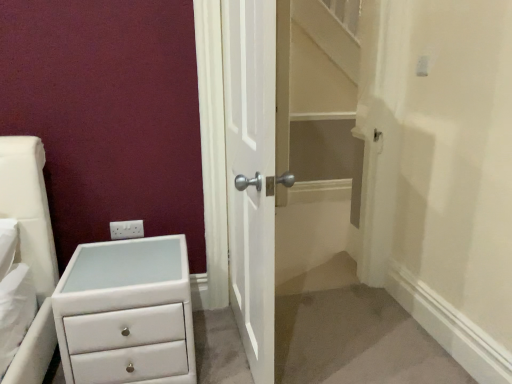
The image size is (512, 384). In order to click on white plastic electric outlet at upper left in this screenshot , I will do `click(126, 229)`.

Describe the element at coordinates (126, 313) in the screenshot. I see `white glossy chest of drawers at lower left` at that location.

The width and height of the screenshot is (512, 384). I want to click on white plastic electric outlet at upper left, so click(126, 229).

Is white plastic electric outlet at upper left turned away from white glossy chest of drawers at lower left?

No, white plastic electric outlet at upper left is not facing the opposite direction of white glossy chest of drawers at lower left.

You are a GUI agent. You are given a task and a screenshot of the screen. Output one action in this format:
    pyautogui.click(x=<x>, y=<y>)
    Task: Click on the electric outlet behind the white glossy chest of drawers at lower left
    This screenshot has width=512, height=384.
    Given the screenshot: What is the action you would take?
    pyautogui.click(x=126, y=229)

From a real-world perspective, between white plastic electric outlet at upper left and white glossy chest of drawers at lower left, who is vertically higher?

white plastic electric outlet at upper left.

In order to click on door that is above the white plastic electric outlet at upper left (from the image's perspective) in this screenshot , I will do `click(253, 169)`.

Is white plastic electric outlet at upper left next to white wooden door at center and touching it?

No, white plastic electric outlet at upper left is not in contact with white wooden door at center.

From a real-world perspective, is white plastic electric outlet at upper left positioned under white wooden door at center based on gravity?

Yes, from a real-world perspective, white plastic electric outlet at upper left is below white wooden door at center.

Who is shorter, white plastic electric outlet at upper left or white wooden door at center?

white plastic electric outlet at upper left is shorter.

Where is `door that appears above the white plastic electric outlet at upper left (from the image's perspective)`? This screenshot has height=384, width=512. door that appears above the white plastic electric outlet at upper left (from the image's perspective) is located at coordinates (253, 169).

From the image's perspective, is white wooden door at center over white plastic electric outlet at upper left?

Yes, from the image's perspective, white wooden door at center is on top of white plastic electric outlet at upper left.

Considering the positions of objects white wooden door at center and white plastic electric outlet at upper left in the image provided, who is more to the right, white wooden door at center or white plastic electric outlet at upper left?

white wooden door at center.

In the scene shown: Do you think white wooden door at center is within white plastic electric outlet at upper left, or outside of it?

white wooden door at center is not enclosed by white plastic electric outlet at upper left.

Is white glossy chest of drawers at lower left taller or shorter than white wooden door at center?

Clearly, white glossy chest of drawers at lower left is shorter compared to white wooden door at center.

From the picture: Considering the sizes of objects white glossy chest of drawers at lower left and white wooden door at center in the image provided, who is wider, white glossy chest of drawers at lower left or white wooden door at center?

Wider between the two is white glossy chest of drawers at lower left.

From a real-world perspective, which object stands above the other?

white wooden door at center, from a real-world perspective.

Is point (180, 244) positioned before point (254, 133)?

No.

Does point (70, 292) lie in front of point (132, 227)?

Yes, it is.

Who is bigger, white glossy chest of drawers at lower left or white plastic electric outlet at upper left?

With larger size is white glossy chest of drawers at lower left.

From a real-world perspective, is white glossy chest of drawers at lower left on white plastic electric outlet at upper left?

Incorrect, from a real-world perspective, white glossy chest of drawers at lower left is lower than white plastic electric outlet at upper left.

How many degrees apart are the facing directions of white glossy chest of drawers at lower left and white plastic electric outlet at upper left?

The facing directions of white glossy chest of drawers at lower left and white plastic electric outlet at upper left are 0.925 degrees apart.

How many degrees apart are the facing directions of white wooden door at center and white glossy chest of drawers at lower left?

The angle between the facing direction of white wooden door at center and the facing direction of white glossy chest of drawers at lower left is 89.7 degrees.

Is white wooden door at center bigger or smaller than white glossy chest of drawers at lower left?

Considering their sizes, white wooden door at center takes up more space than white glossy chest of drawers at lower left.

This screenshot has height=384, width=512. Find the location of `the chest of drawers located underneath the white wooden door at center (from a real-world perspective)`. the chest of drawers located underneath the white wooden door at center (from a real-world perspective) is located at coordinates (126, 313).

Relative to white glossy chest of drawers at lower left, is white wooden door at center in front or behind?

white wooden door at center is in front of white glossy chest of drawers at lower left.

The image size is (512, 384). I want to click on electric outlet on the left of white glossy chest of drawers at lower left, so click(x=126, y=229).

Find the location of a particular element. door located above the white plastic electric outlet at upper left (from the image's perspective) is located at coordinates (253, 169).

Considering their positions, is white wooden door at center positioned closer to white plastic electric outlet at upper left than white glossy chest of drawers at lower left?

Among the two, white glossy chest of drawers at lower left is located nearer to white plastic electric outlet at upper left.

From the picture: When comparing their distances from white glossy chest of drawers at lower left, does white plastic electric outlet at upper left or white wooden door at center seem closer?

white plastic electric outlet at upper left lies closer to white glossy chest of drawers at lower left than the other object.

Estimate the real-world distances between objects in this image. Which object is further from white glossy chest of drawers at lower left, white wooden door at center or white plastic electric outlet at upper left?

white wooden door at center is positioned further to the anchor white glossy chest of drawers at lower left.

Based on their spatial positions, is white plastic electric outlet at upper left or white glossy chest of drawers at lower left closer to white wooden door at center?

white glossy chest of drawers at lower left is positioned closer to the anchor white wooden door at center.

Considering their positions, is white glossy chest of drawers at lower left positioned closer to white wooden door at center than white plastic electric outlet at upper left?

white glossy chest of drawers at lower left lies closer to white wooden door at center than the other object.

Which object lies nearer to the anchor point white plastic electric outlet at upper left, white glossy chest of drawers at lower left or white wooden door at center?

white glossy chest of drawers at lower left.

The height and width of the screenshot is (384, 512). Identify the location of chest of drawers between white wooden door at center and white plastic electric outlet at upper left in the front-back direction. (126, 313).